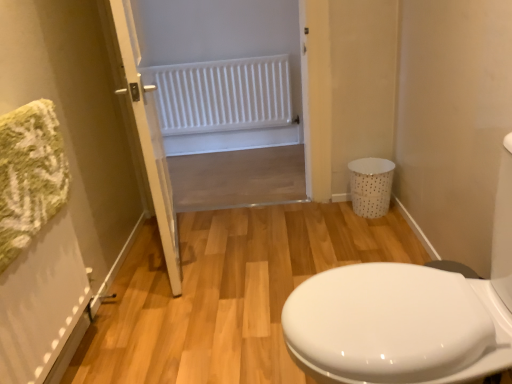
Question: Considering the relative positions of white dotted plastic laundry basket at right and white plastic radiator at upper center in the image provided, is white dotted plastic laundry basket at right to the right of white plastic radiator at upper center from the viewer's perspective?

Choices:
 (A) no
 (B) yes

Answer: (B)

Question: Can you confirm if white dotted plastic laundry basket at right is shorter than white plastic radiator at upper center?

Choices:
 (A) no
 (B) yes

Answer: (B)

Question: Can you confirm if white dotted plastic laundry basket at right is thinner than white plastic radiator at upper center?

Choices:
 (A) no
 (B) yes

Answer: (A)

Question: Is white dotted plastic laundry basket at right further to the viewer compared to white plastic radiator at upper center?

Choices:
 (A) yes
 (B) no

Answer: (A)

Question: Is white dotted plastic laundry basket at right smaller than white plastic radiator at upper center?

Choices:
 (A) no
 (B) yes

Answer: (B)

Question: Considering the relative positions of white wooden door at center and white plastic radiator at upper center in the image provided, is white wooden door at center to the left or to the right of white plastic radiator at upper center?

Choices:
 (A) left
 (B) right

Answer: (A)

Question: Based on their sizes in the image, would you say white wooden door at center is bigger or smaller than white plastic radiator at upper center?

Choices:
 (A) big
 (B) small

Answer: (B)

Question: From a real-world perspective, is white wooden door at center above or below white plastic radiator at upper center?

Choices:
 (A) above
 (B) below

Answer: (A)

Question: Would you say white wooden door at center is inside or outside white plastic radiator at upper center?

Choices:
 (A) outside
 (B) inside

Answer: (A)

Question: Looking at the image, does white dotted plastic laundry basket at right seem bigger or smaller compared to white matte radiator at upper center?

Choices:
 (A) small
 (B) big

Answer: (A)

Question: Does point (373, 200) appear closer or farther from the camera than point (163, 124)?

Choices:
 (A) closer
 (B) farther

Answer: (A)

Question: In terms of width, does white dotted plastic laundry basket at right look wider or thinner when compared to white matte radiator at upper center?

Choices:
 (A) thin
 (B) wide

Answer: (B)

Question: From a real-world perspective, is white dotted plastic laundry basket at right above or below white matte radiator at upper center?

Choices:
 (A) below
 (B) above

Answer: (A)

Question: From a real-world perspective, is white glossy porcelain at right above or below white matte radiator at upper center?

Choices:
 (A) above
 (B) below

Answer: (B)

Question: Is white glossy porcelain at right spatially inside white matte radiator at upper center, or outside of it?

Choices:
 (A) outside
 (B) inside

Answer: (A)